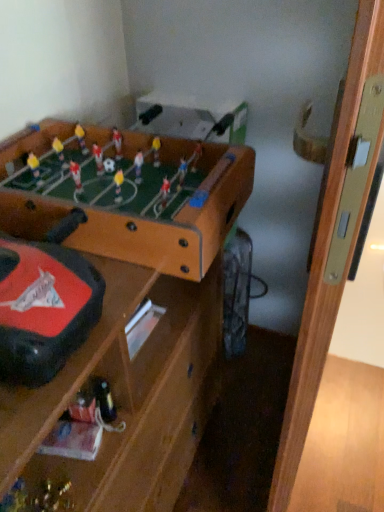
Question: Does brown wooden table at upper left, positioned as the second table in bottom-to-top order, come in front of brown wooden table at center, which is the 1th table from bottom to top?

Choices:
 (A) yes
 (B) no

Answer: (B)

Question: Considering the relative sizes of brown wooden table at upper left, positioned as the second table in bottom-to-top order, and brown wooden table at center, the 2th table from the top, in the image provided, is brown wooden table at upper left, positioned as the second table in bottom-to-top order, wider than brown wooden table at center, the 2th table from the top,?

Choices:
 (A) yes
 (B) no

Answer: (A)

Question: Is brown wooden table at upper left, positioned as the second table in bottom-to-top order, thinner than brown wooden table at center, which is the 1th table from bottom to top?

Choices:
 (A) yes
 (B) no

Answer: (B)

Question: Is brown wooden table at upper left, positioned as the second table in bottom-to-top order, at the right side of brown wooden table at center, which is the 1th table from bottom to top?

Choices:
 (A) yes
 (B) no

Answer: (A)

Question: Can you confirm if brown wooden table at upper left, which ranks as the first table in top-to-bottom order, is bigger than brown wooden table at center, the 2th table from the top?

Choices:
 (A) yes
 (B) no

Answer: (B)

Question: From the image's perspective, is brown wooden table at upper left, positioned as the second table in bottom-to-top order, above or below brown wooden table at center, the 2th table from the top?

Choices:
 (A) above
 (B) below

Answer: (A)

Question: Is brown wooden table at upper left, which ranks as the first table in top-to-bottom order, taller or shorter than brown wooden table at center, which is the 1th table from bottom to top?

Choices:
 (A) short
 (B) tall

Answer: (A)

Question: From a real-world perspective, is brown wooden table at upper left, positioned as the second table in bottom-to-top order, positioned above or below brown wooden table at center, the 2th table from the top?

Choices:
 (A) above
 (B) below

Answer: (A)

Question: Is brown wooden table at upper left, positioned as the second table in bottom-to-top order, inside the boundaries of brown wooden table at center, the 2th table from the top, or outside?

Choices:
 (A) outside
 (B) inside

Answer: (B)

Question: Relative to metallic gold trophy at lower left, is brown wooden table at upper left, positioned as the second table in bottom-to-top order, in front or behind?

Choices:
 (A) front
 (B) behind

Answer: (A)

Question: Does point pyautogui.click(x=180, y=244) appear closer or farther from the camera than point pyautogui.click(x=8, y=510)?

Choices:
 (A) closer
 (B) farther

Answer: (B)

Question: In terms of width, does brown wooden table at upper left, positioned as the second table in bottom-to-top order, look wider or thinner when compared to metallic gold trophy at lower left?

Choices:
 (A) wide
 (B) thin

Answer: (A)

Question: From a real-world perspective, is brown wooden table at upper left, positioned as the second table in bottom-to-top order, above or below metallic gold trophy at lower left?

Choices:
 (A) above
 (B) below

Answer: (A)

Question: From the image's perspective, is metallic gold trophy at lower left located above or below brown wooden table at upper left, which ranks as the first table in top-to-bottom order?

Choices:
 (A) below
 (B) above

Answer: (A)

Question: Relative to brown wooden table at upper left, which ranks as the first table in top-to-bottom order, is metallic gold trophy at lower left in front or behind?

Choices:
 (A) behind
 (B) front

Answer: (A)